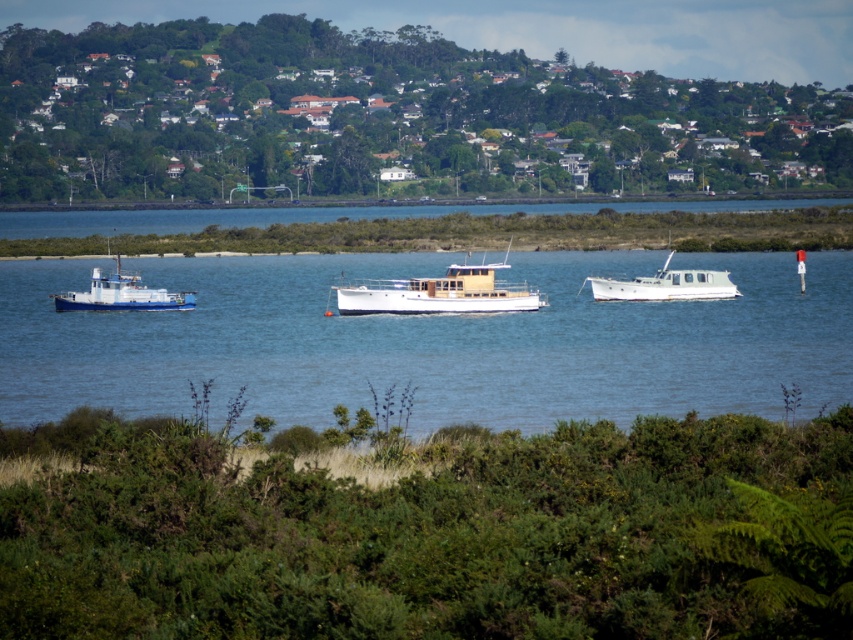
Looking at this image, you are standing at the point with coordinates (x=439, y=292) in the coastal scene. What object is located exactly at your current position?

The wooden cabin cruiser at center is located exactly at the point with coordinates (x=439, y=292).

You are a photographer standing at the edge of the coast, and you want to take a photo of the boats. There are two points marked in the scene, point A at coordinates point (508, 243) and point B at coordinates point (99, 298). Which point is closer to your camera lens?

Point A at coordinates point (508, 243) is closer to the camera lens because it is further to the viewer than point B at coordinates point (99, 298).